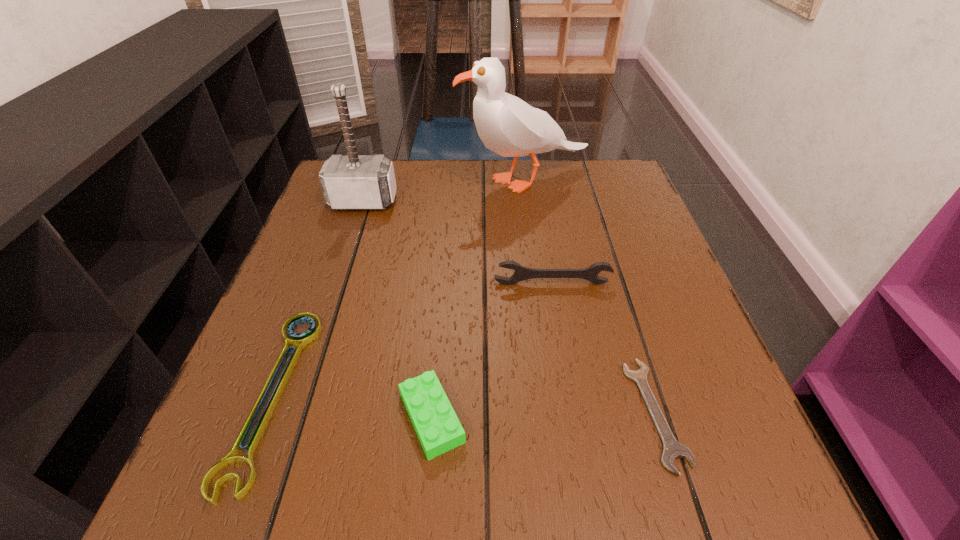
Identify the location of vacant region between the Lego and the fifth tallest object. (352, 407).

Locate an element on the screen. free space between the gull and the hammer is located at coordinates (444, 191).

Image resolution: width=960 pixels, height=540 pixels. In order to click on free space between the leftmost wrench and the shortest object in this screenshot , I will do `click(464, 404)`.

Identify the location of the closest object relative to the shortest wrench. The height and width of the screenshot is (540, 960). (521, 273).

Select which object is the closest to the third farthest object. Please provide its 2D coordinates. Your answer should be formatted as a tuple, i.e. [(x, y)], where the tuple contains the x and y coordinates of a point satisfying the conditions above.

[(672, 449)]

Identify the location of wrench that is the second closest to the gull. The image size is (960, 540). (301, 340).

You are a GUI agent. You are given a task and a screenshot of the screen. Output one action in this format:
    pyautogui.click(x=<x>, y=<y>)
    Task: Click on the wrench that is the closest to the shortest wrench
    This screenshot has height=540, width=960.
    Given the screenshot: What is the action you would take?
    pyautogui.click(x=521, y=273)

Where is `vacant space that satisfies the following two spatial constraints: 1. for striking with the head of the hammer; 2. on the left side of the shortest object`? Image resolution: width=960 pixels, height=540 pixels. vacant space that satisfies the following two spatial constraints: 1. for striking with the head of the hammer; 2. on the left side of the shortest object is located at coordinates (293, 413).

The image size is (960, 540). I want to click on blank space that satisfies the following two spatial constraints: 1. for striking with the head of the hammer; 2. on the right side of the shortest object, so click(293, 413).

In order to click on free point that satisfies the following two spatial constraints: 1. at the beak of the gull; 2. for striking with the head of the hammer in this screenshot , I will do `click(527, 201)`.